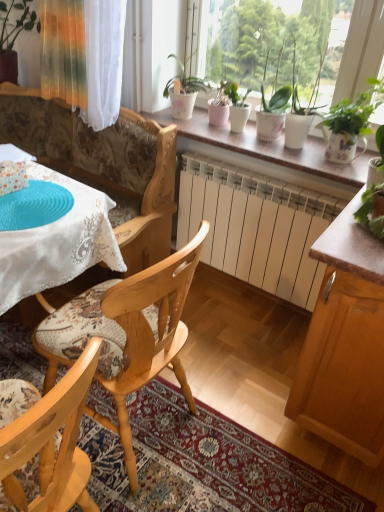
Where is `free space in front of matte white pot at center, arranged as the second houseplant when viewed from the right`? The width and height of the screenshot is (384, 512). free space in front of matte white pot at center, arranged as the second houseplant when viewed from the right is located at coordinates (247, 137).